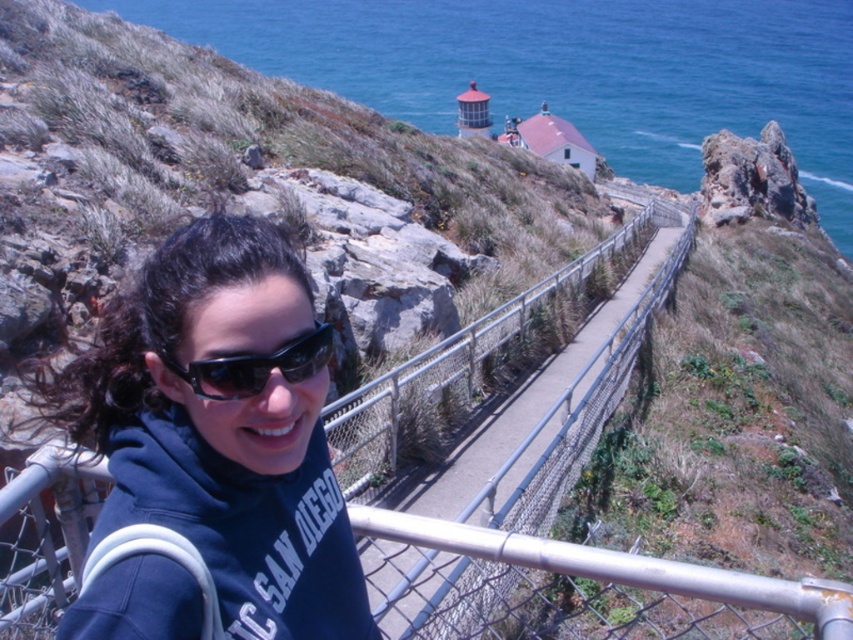
Question: Which point is closer to the camera?

Choices:
 (A) (306, 289)
 (B) (650, 204)
 (C) (276, 28)
 (D) (234, 358)

Answer: (D)

Question: Can you confirm if blue water at upper center is bigger than black plastic sunglasses at center?

Choices:
 (A) yes
 (B) no

Answer: (A)

Question: Which point appears closest to the camera in this image?

Choices:
 (A) (320, 368)
 (B) (334, 426)
 (C) (244, 616)
 (D) (706, 100)

Answer: (C)

Question: Which of the following is the closest to the observer?

Choices:
 (A) dark blue hoodie at center
 (B) blue water at upper center
 (C) metal fence at center

Answer: (A)

Question: Is dark blue hoodie at center below black plastic sunglasses at center?

Choices:
 (A) yes
 (B) no

Answer: (A)

Question: Does dark blue hoodie at center have a greater width compared to black plastic sunglasses at center?

Choices:
 (A) no
 (B) yes

Answer: (B)